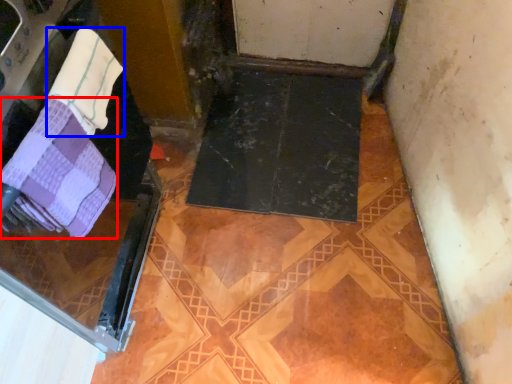
Question: Which object appears farthest to the camera in this image, towel (highlighted by a red box) or towel (highlighted by a blue box)?

Choices:
 (A) towel
 (B) towel

Answer: (B)